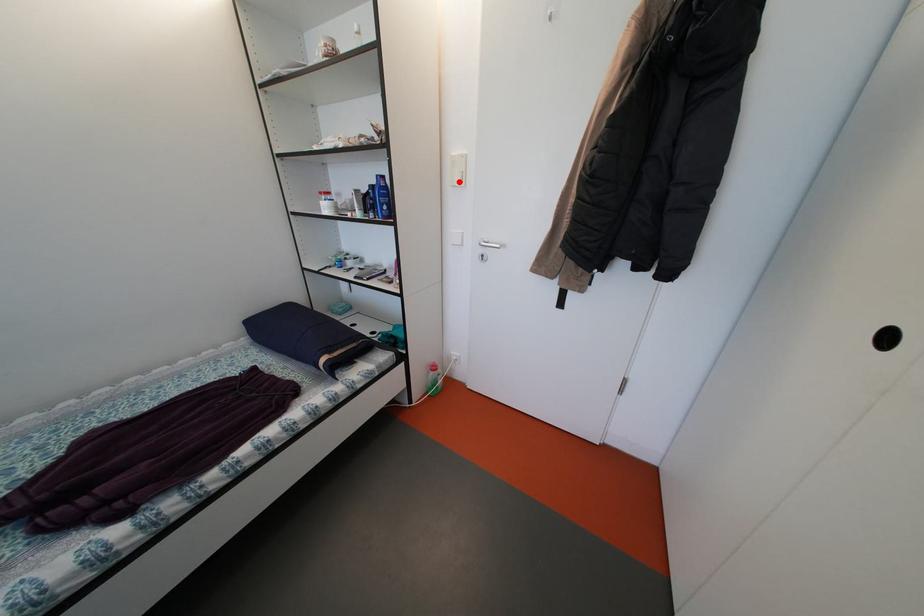
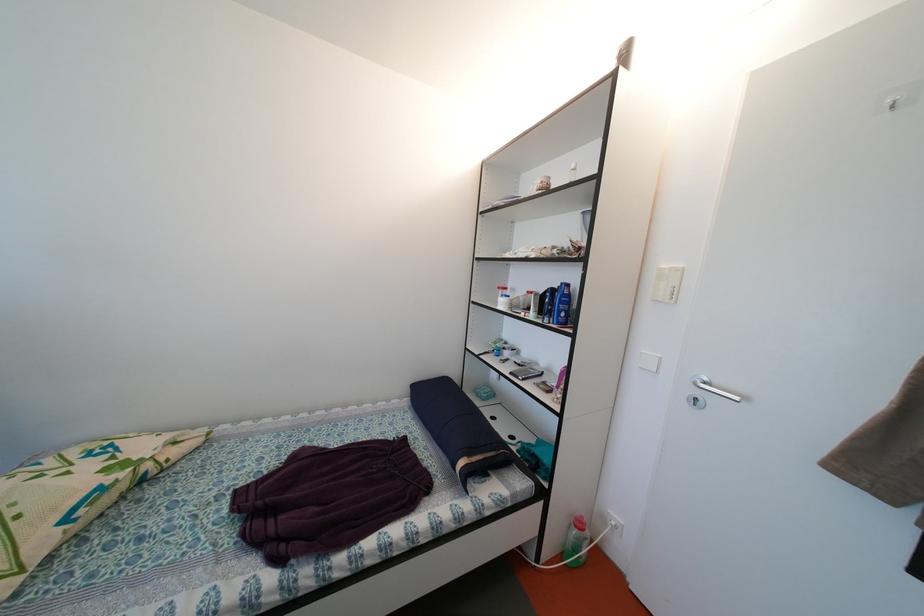
Find the pixel in the second image that matches the highlighted location in the first image.

(662, 294)